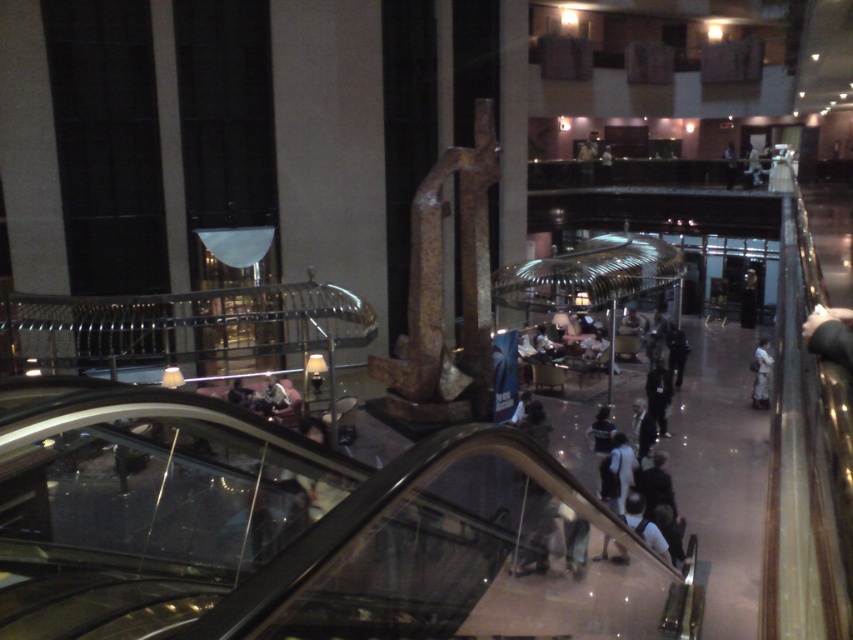
Question: Which object is positioned closest to the white fabric bag at lower right?

Choices:
 (A) matte black jacket at center
 (B) white fabric person at lower right
 (C) dark gray fabric jacket at center

Answer: (B)

Question: Which object appears closest to the camera in this image?

Choices:
 (A) dark gray fabric pants at lower right
 (B) dark gray fabric pants at center

Answer: (B)

Question: Is white fabric person at lower right thinner than white fabric bag at lower right?

Choices:
 (A) yes
 (B) no

Answer: (A)

Question: Can you confirm if white fabric person at lower right is bigger than matte black jacket at center?

Choices:
 (A) no
 (B) yes

Answer: (B)

Question: Which point is closer to the camera taking this photo?

Choices:
 (A) (636, 435)
 (B) (621, 554)

Answer: (B)

Question: Does white fabric person at lower right appear on the right side of dark gray fabric pants at lower right?

Choices:
 (A) yes
 (B) no

Answer: (B)